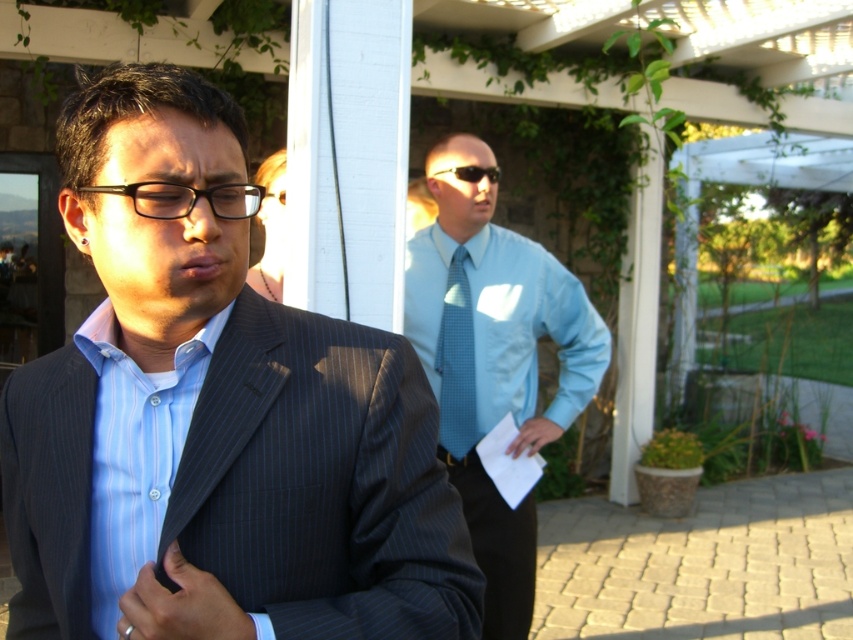
Question: Does light blue shirt at center come in front of light blue striped dress shirt at left?

Choices:
 (A) yes
 (B) no

Answer: (B)

Question: Estimate the real-world distances between objects in this image. Which object is farther from the blue textured tie at center?

Choices:
 (A) sunglasses at center
 (B) pinstriped suit at center

Answer: (B)

Question: Does light blue shirt at center appear over light blue smooth dress shirt at center?

Choices:
 (A) yes
 (B) no

Answer: (B)

Question: Which point appears farthest from the camera in this image?

Choices:
 (A) (444, 380)
 (B) (113, 637)

Answer: (A)

Question: In this image, where is light blue smooth dress shirt at center located relative to blue textured tie at center?

Choices:
 (A) left
 (B) right

Answer: (B)

Question: Which is nearer to the light blue smooth dress shirt at center?

Choices:
 (A) black plastic glasses at center
 (B) light blue striped dress shirt at left

Answer: (B)